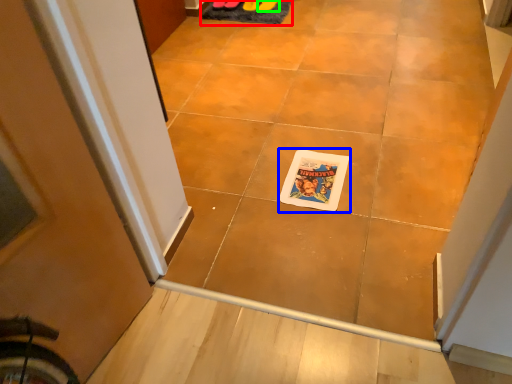
Question: Which object is the farthest from doormat (highlighted by a red box)? Choose among these: comic book character (highlighted by a blue box) or footwear (highlighted by a green box).

Choices:
 (A) comic book character
 (B) footwear

Answer: (A)